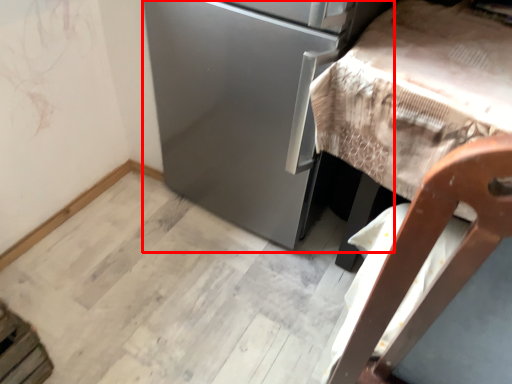
Question: From the image's perspective, what is the correct spatial positioning of appliance (annotated by the red box) in reference to furniture?

Choices:
 (A) below
 (B) above

Answer: (B)